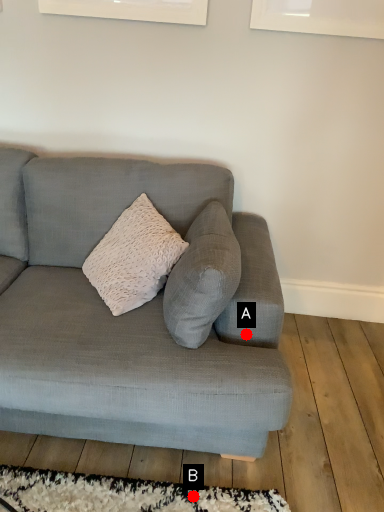
Question: Two points are circled on the image, labeled by A and B beside each circle. Which point is closer to the camera?

Choices:
 (A) A is closer
 (B) B is closer

Answer: (B)